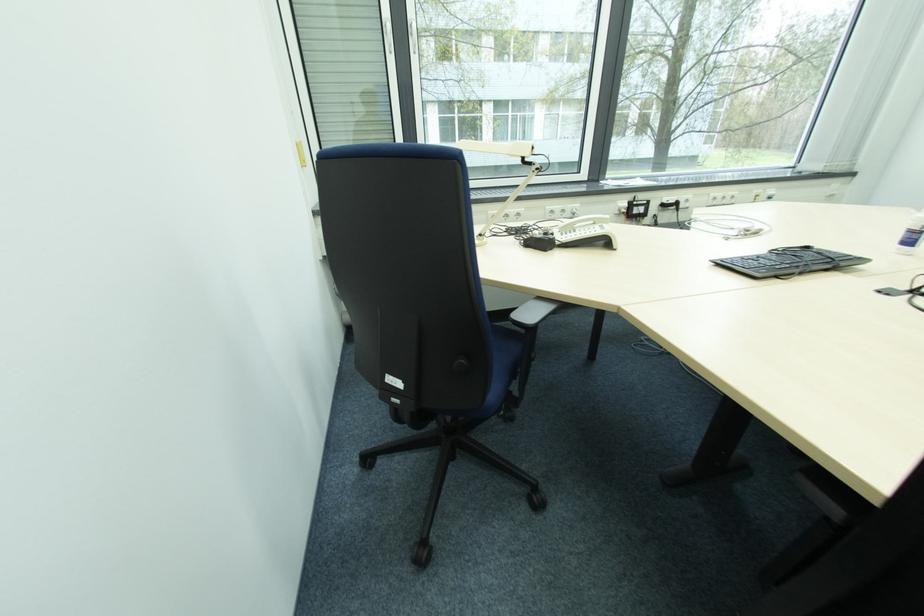
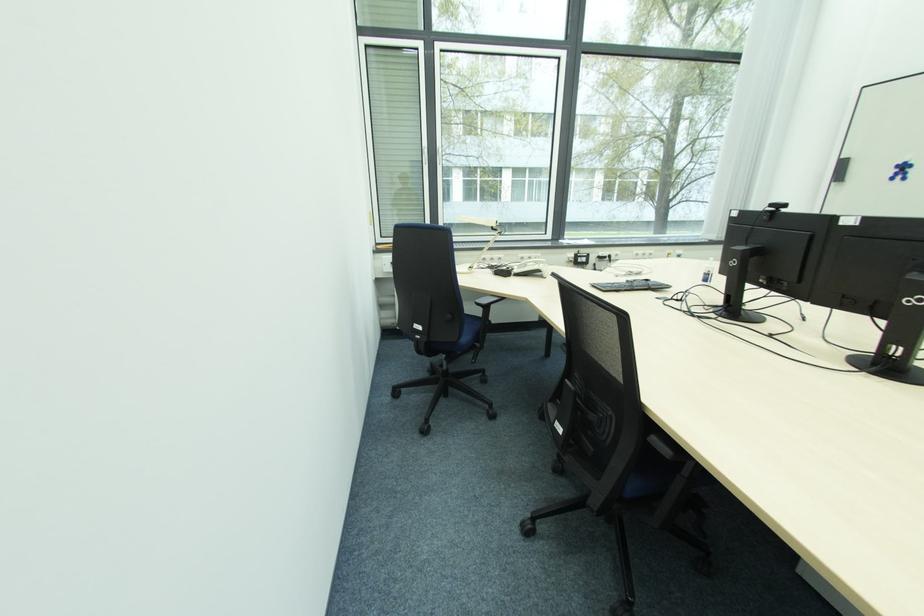
The point at (808, 251) is marked in the first image. Where is the corresponding point in the second image?

(650, 283)